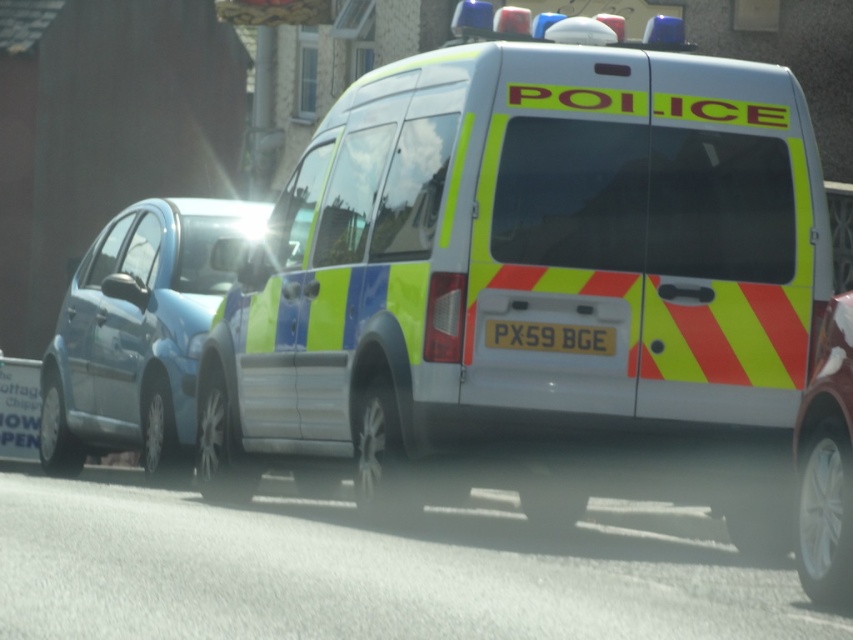
You are a pedestrian standing on the sidewalk and see the reflective yellow and blue van at center and the shiny silver wheel at lower right. Which object is closer to you?

The reflective yellow and blue van at center is closer to you because it is further to the viewer than the shiny silver wheel at lower right.

Based on the photo, you are a pedestrian standing on the sidewalk and see the police van. Which object, the shiny silver wheel at lower right or the yellow reflective plastic at rear, is closer to your right side?

The shiny silver wheel at lower right is closer to your right side because it is positioned to the right of the yellow reflective plastic at rear.